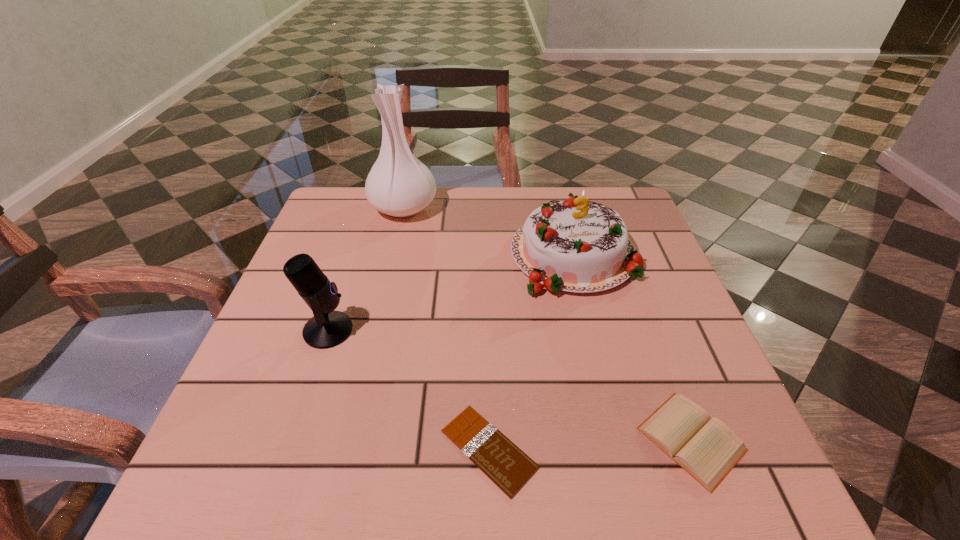
This screenshot has height=540, width=960. Identify the location of empty space between the microphone and the cake. (451, 293).

Locate an element on the screen. This screenshot has height=540, width=960. vacant space in between the vase and the cake is located at coordinates (489, 231).

The height and width of the screenshot is (540, 960). In order to click on vacant space that's between the tallest object and the cake in this screenshot , I will do `click(489, 231)`.

Locate an element on the screen. The image size is (960, 540). empty space that is in between the microphone and the second shortest object is located at coordinates (510, 384).

At what (x,y) coordinates should I click in order to perform the action: click on vacant space in between the diary and the cake. Please return your answer as a coordinate pair (x, y). This screenshot has height=540, width=960. Looking at the image, I should click on (633, 347).

Where is `vacant space that is in between the tallest object and the microphone`? vacant space that is in between the tallest object and the microphone is located at coordinates (366, 269).

Locate an element on the screen. The width and height of the screenshot is (960, 540). object that stands as the fourth closest to the diary is located at coordinates (400, 185).

Select which object is the closest to the cake. Please provide its 2D coordinates. Your answer should be formatted as a tuple, i.e. [(x, y)], where the tuple contains the x and y coordinates of a point satisfying the conditions above.

[(400, 185)]

I want to click on vacant space that satisfies the following two spatial constraints: 1. on the front side of the cake; 2. on the left side of the diary, so click(x=619, y=439).

This screenshot has height=540, width=960. Find the location of `free region that satisfies the following two spatial constraints: 1. on the stand of the third nearest object; 2. on the back side of the shortest object`. free region that satisfies the following two spatial constraints: 1. on the stand of the third nearest object; 2. on the back side of the shortest object is located at coordinates tap(288, 449).